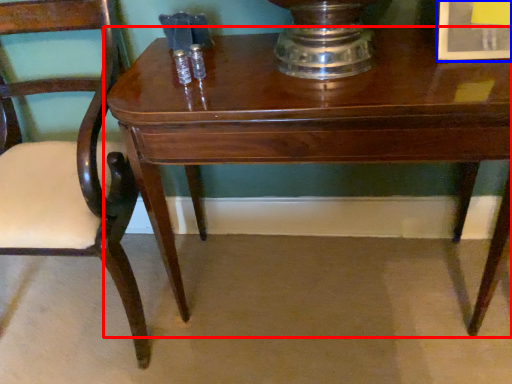
Question: Among these objects, which one is nearest to the camera, table (highlighted by a red box) or picture frame (highlighted by a blue box)?

Choices:
 (A) table
 (B) picture frame

Answer: (A)